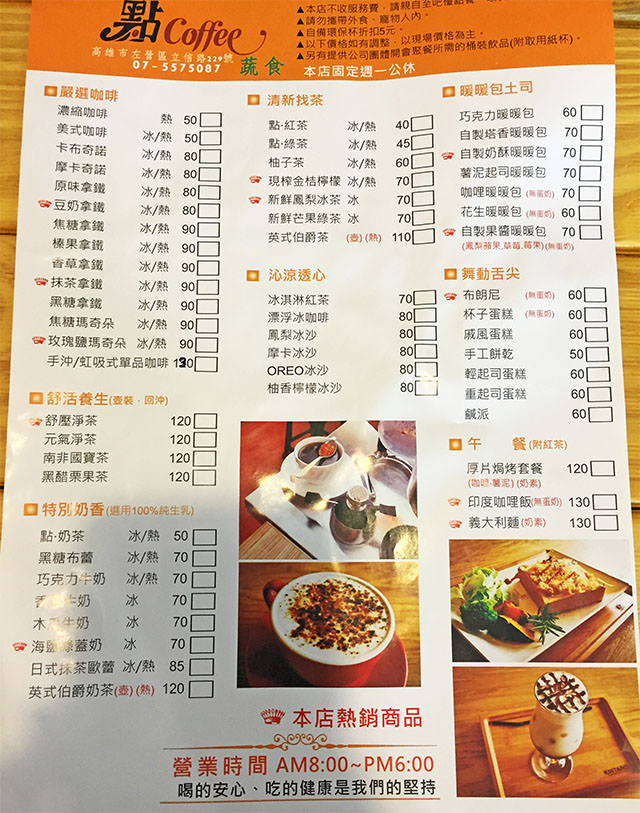
Identify the location of base of cup. This screenshot has height=813, width=640. (552, 770).